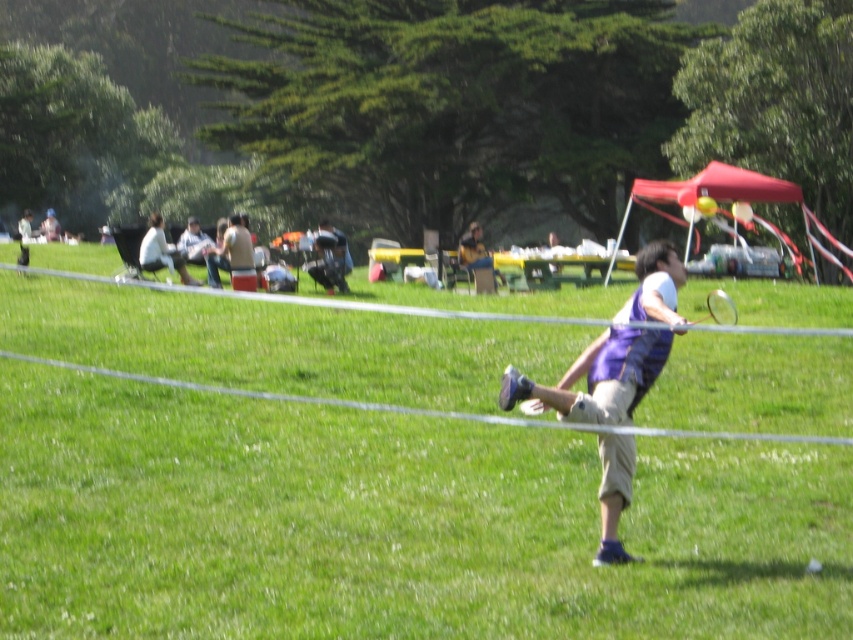
Question: Is green grassy field at center thinner than purple fabric shirt at center?

Choices:
 (A) yes
 (B) no

Answer: (B)

Question: Which of the following is the closest to the observer?

Choices:
 (A) purple striped vest at center
 (B) light brown fabric jacket at upper left
 (C) purple fabric shirt at center
 (D) green grassy field at center

Answer: (D)

Question: Does green grassy field at center have a smaller size compared to purple fabric shirt at center?

Choices:
 (A) no
 (B) yes

Answer: (A)

Question: Estimate the real-world distances between objects in this image. Which object is farther from the purple fabric shirt at center?

Choices:
 (A) purple striped vest at center
 (B) light brown fabric jacket at upper left
 (C) green grassy field at center

Answer: (A)

Question: Is light brown fabric jacket at upper left below purple fabric shirt at center?

Choices:
 (A) no
 (B) yes

Answer: (A)

Question: Which object is closer to the camera taking this photo?

Choices:
 (A) purple fabric shirt at center
 (B) green grassy field at center
 (C) purple striped vest at center

Answer: (B)